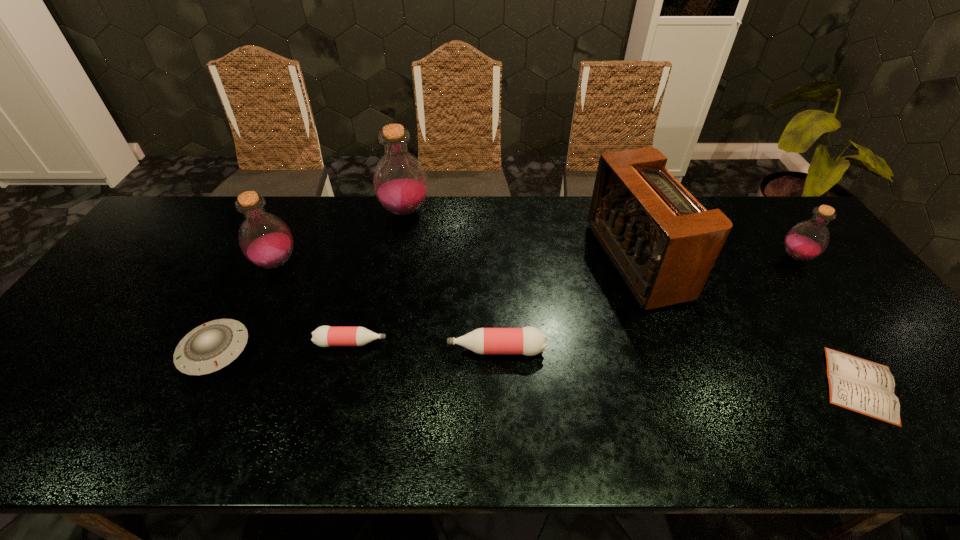
What are the coordinates of `free space located 0.160m with the cap open on the bigger pink bottle` in the screenshot? It's located at (383, 350).

Identify the location of vacant space located with the cap open on the left pink bottle. (435, 343).

The image size is (960, 540). I want to click on vacant space situated 0.300m on the back of the saucer, so click(268, 248).

Where is `free space located 0.150m on the left of the white diary`? The height and width of the screenshot is (540, 960). free space located 0.150m on the left of the white diary is located at coordinates (754, 384).

Locate an element on the screen. The width and height of the screenshot is (960, 540). bottle at the far edge is located at coordinates (400, 182).

The height and width of the screenshot is (540, 960). Identify the location of radio receiver located in the far edge section of the desktop. (663, 242).

The height and width of the screenshot is (540, 960). In order to click on object present at the near edge in this screenshot , I will do `click(856, 384)`.

Image resolution: width=960 pixels, height=540 pixels. In order to click on bottle that is at the right edge in this screenshot , I will do `click(808, 239)`.

This screenshot has width=960, height=540. I want to click on diary that is at the right edge, so click(x=856, y=384).

Locate an element on the screen. object located in the near right corner section of the desktop is located at coordinates 856,384.